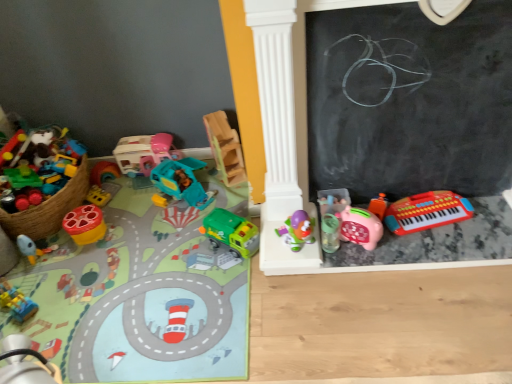
Question: Is purple plastic toy at center, the 9th toy in the left-to-right sequence, far from black chalkboard at right?

Choices:
 (A) no
 (B) yes

Answer: (A)

Question: Is purple plastic toy at center, the 9th toy in the left-to-right sequence, at the left side of black chalkboard at right?

Choices:
 (A) no
 (B) yes

Answer: (B)

Question: From the image's perspective, is purple plastic toy at center, the 9th toy in the left-to-right sequence, above black chalkboard at right?

Choices:
 (A) yes
 (B) no

Answer: (B)

Question: Considering the relative sizes of purple plastic toy at center, the 9th toy in the left-to-right sequence, and black chalkboard at right in the image provided, is purple plastic toy at center, the 9th toy in the left-to-right sequence, thinner than black chalkboard at right?

Choices:
 (A) no
 (B) yes

Answer: (A)

Question: Is purple plastic toy at center, the 9th toy in the left-to-right sequence, positioned before black chalkboard at right?

Choices:
 (A) yes
 (B) no

Answer: (B)

Question: Is black chalkboard at right bigger or smaller than teal plastic car at center, positioned as the sixth toy in left-to-right order?

Choices:
 (A) big
 (B) small

Answer: (A)

Question: Is black chalkboard at right inside or outside of teal plastic car at center, positioned as the sixth toy in left-to-right order?

Choices:
 (A) outside
 (B) inside

Answer: (A)

Question: Is black chalkboard at right taller or shorter than teal plastic car at center, positioned as the sixth toy in left-to-right order?

Choices:
 (A) short
 (B) tall

Answer: (B)

Question: From the image's perspective, is black chalkboard at right located above or below teal plastic car at center, marked as the 7th toy in a right-to-left arrangement?

Choices:
 (A) above
 (B) below

Answer: (A)

Question: From a real-world perspective, is green plastic toy truck at center, placed as the eighth toy when sorted from left to right, above or below purple plastic toy at center, the 9th toy in the left-to-right sequence?

Choices:
 (A) above
 (B) below

Answer: (B)

Question: From their relative heights in the image, would you say green plastic toy truck at center, the 5th toy from the right, is taller or shorter than purple plastic toy at center, which is counted as the fourth toy, starting from the right?

Choices:
 (A) short
 (B) tall

Answer: (B)

Question: Considering the positions of green plastic toy truck at center, placed as the eighth toy when sorted from left to right, and purple plastic toy at center, the 9th toy in the left-to-right sequence, in the image, is green plastic toy truck at center, placed as the eighth toy when sorted from left to right, wider or thinner than purple plastic toy at center, the 9th toy in the left-to-right sequence,?

Choices:
 (A) wide
 (B) thin

Answer: (B)

Question: From the image's perspective, is green plastic toy truck at center, placed as the eighth toy when sorted from left to right, positioned above or below purple plastic toy at center, the 9th toy in the left-to-right sequence?

Choices:
 (A) above
 (B) below

Answer: (B)

Question: Relative to wooden blocks at center, which is the 7th toy from left to right, is purple plastic toy at center, the 9th toy in the left-to-right sequence, in front or behind?

Choices:
 (A) behind
 (B) front

Answer: (B)

Question: Based on their sizes in the image, would you say purple plastic toy at center, which is counted as the fourth toy, starting from the right, is bigger or smaller than wooden blocks at center, the sixth toy in the right-to-left sequence?

Choices:
 (A) big
 (B) small

Answer: (B)